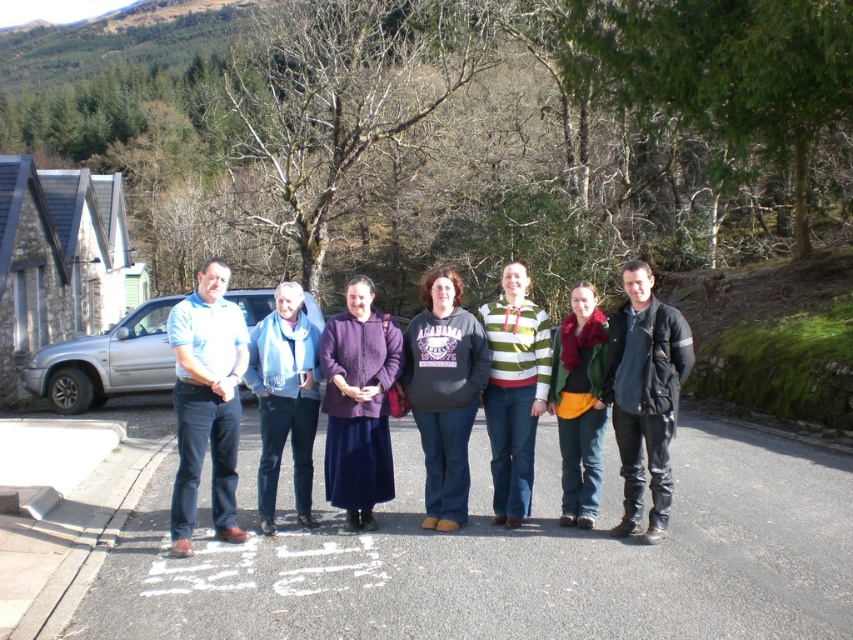
You are standing at the origin of a coordinate system placed at the bottom left corner of the image. You see a point at coordinate (643, 394). What object is located at that point?

The point at coordinate (643, 394) corresponds to the black leather jacket at center.

You are a photographer planning to take a group photo of the people in the scene. You want to ensure that the black leather jacket at center and the purple woolen sweater at center are both clearly visible in the frame. Considering their widths, which of these two items should you position closer to the camera to maintain clarity and detail?

The black leather jacket at center is wider than the purple woolen sweater at center. To maintain clarity and detail, you should position the wider item, the black leather jacket at center, closer to the camera so that its broader dimensions can be captured effectively without distortion.